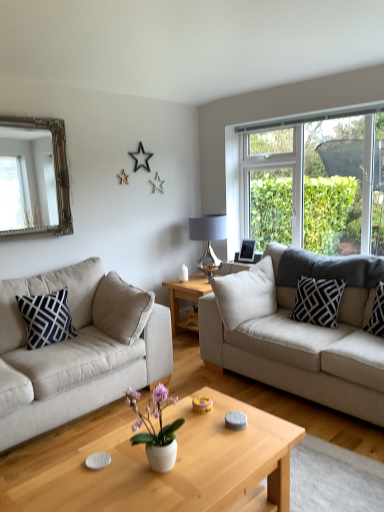
The width and height of the screenshot is (384, 512). In order to click on vacant space to the right of white ceramic pot at center in this screenshot , I will do `click(203, 468)`.